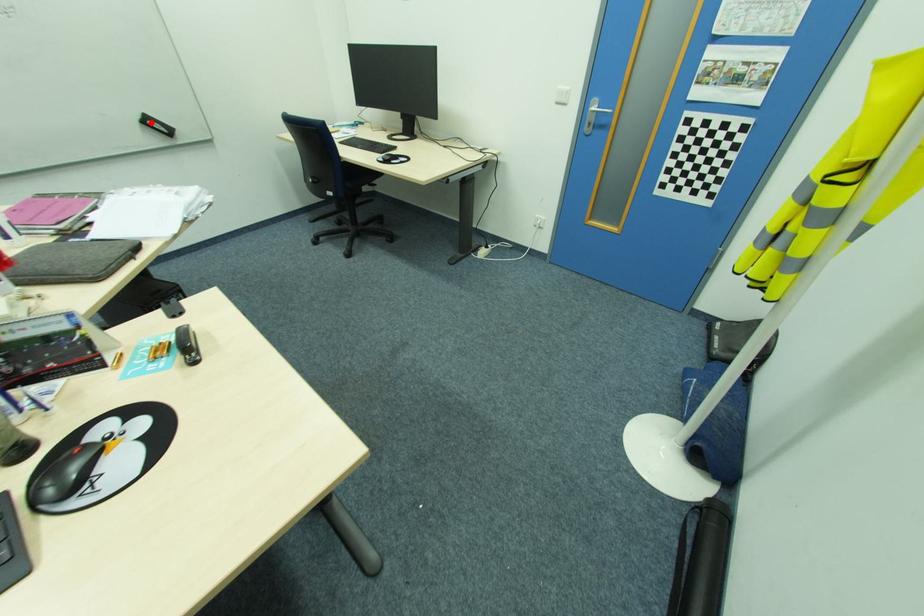
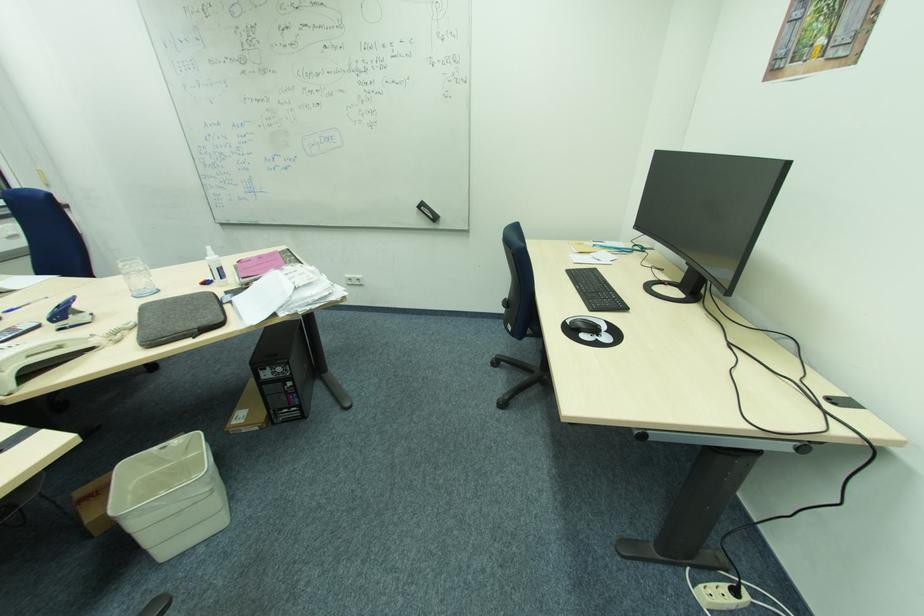
The point at the highlighted location is marked in the first image. Where is the corresponding point in the second image?

(426, 208)